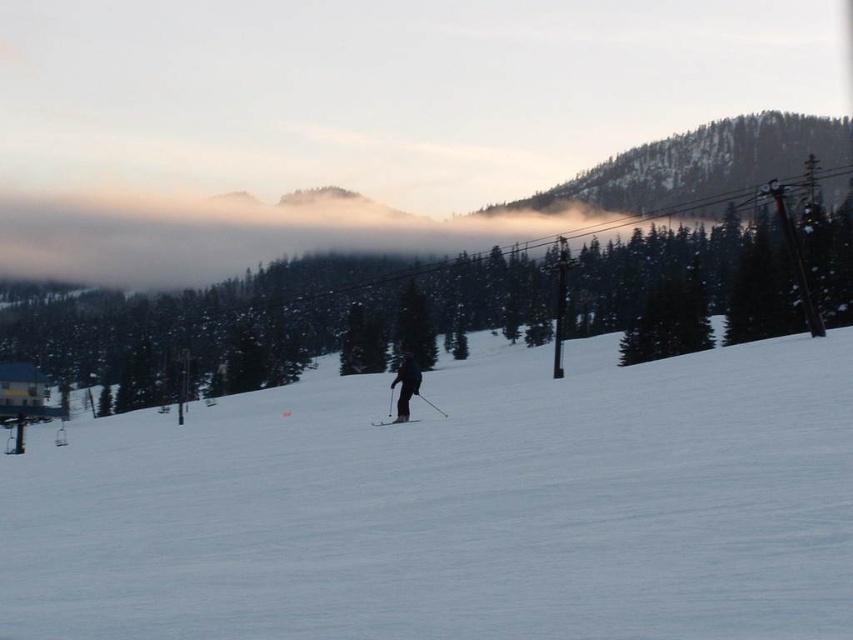
Question: Is white snow ski slope at center to the right of dark blue ski suit at center from the viewer's perspective?

Choices:
 (A) yes
 (B) no

Answer: (B)

Question: Where is white snow ski slope at center located in relation to matte black ski at center in the image?

Choices:
 (A) right
 (B) left

Answer: (B)

Question: In this image, where is white snow ski slope at center located relative to matte black ski at center?

Choices:
 (A) right
 (B) left

Answer: (B)

Question: Estimate the real-world distances between objects in this image. Which object is farther from the matte black ski at center?

Choices:
 (A) dark blue ski suit at center
 (B) white snow ski slope at center

Answer: (B)

Question: Estimate the real-world distances between objects in this image. Which object is farther from the matte black ski at center?

Choices:
 (A) white snow ski slope at center
 (B) dark blue ski suit at center

Answer: (A)

Question: Estimate the real-world distances between objects in this image. Which object is closer to the white snow ski slope at center?

Choices:
 (A) matte black ski at center
 (B) dark blue ski suit at center

Answer: (A)